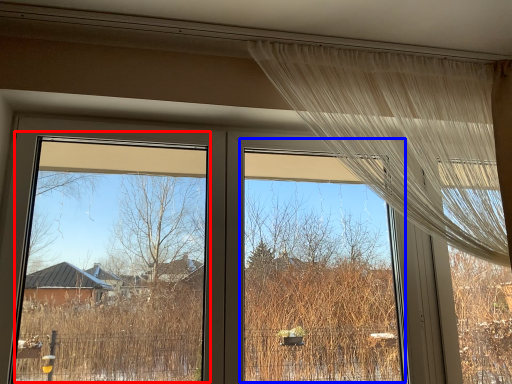
Question: Which of the following is the farthest to the observer, window screen (highlighted by a red box) or window screen (highlighted by a blue box)?

Choices:
 (A) window screen
 (B) window screen

Answer: (B)